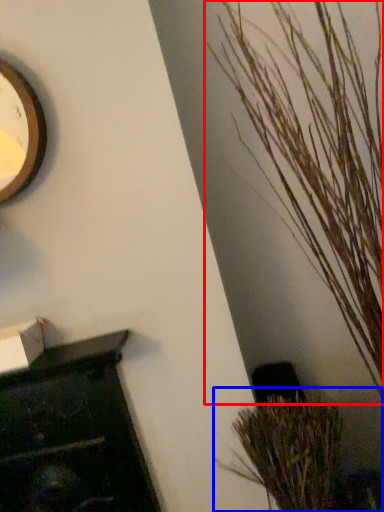
Question: Which object is further to the camera taking this photo, houseplant (highlighted by a red box) or houseplant (highlighted by a blue box)?

Choices:
 (A) houseplant
 (B) houseplant

Answer: (B)